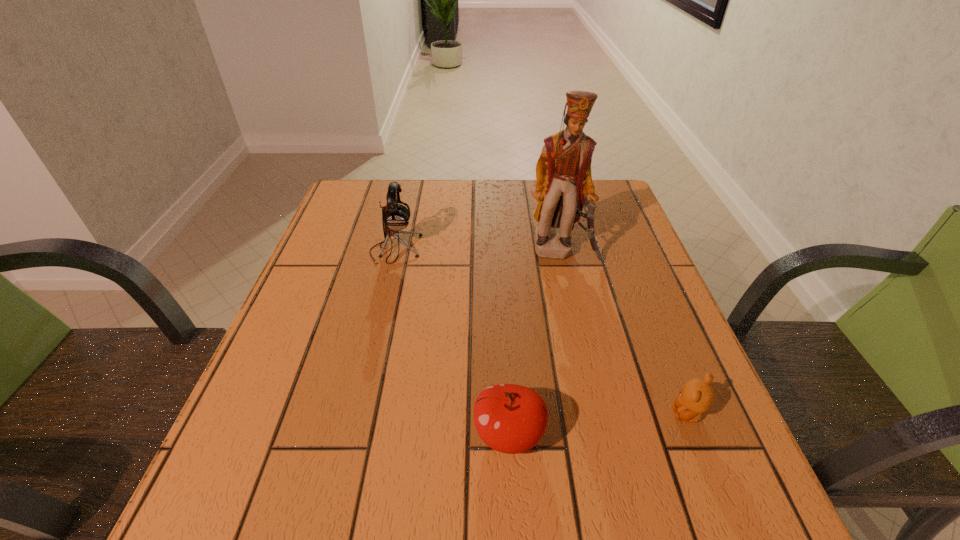
Where is `vacant region located on the left of the second object from left to right`? vacant region located on the left of the second object from left to right is located at coordinates (340, 434).

This screenshot has height=540, width=960. Identify the location of free spot located 0.080m on the face of the rightmost object. (625, 414).

Identify the location of vacant space situated on the face of the rightmost object. This screenshot has height=540, width=960. (572, 414).

Where is `free spot located 0.180m on the face of the rightmost object`? The image size is (960, 540). free spot located 0.180m on the face of the rightmost object is located at coordinates (566, 414).

Where is `object at the left edge`? This screenshot has width=960, height=540. object at the left edge is located at coordinates (395, 217).

Where is `nutcracker that is at the right edge`? The width and height of the screenshot is (960, 540). nutcracker that is at the right edge is located at coordinates (564, 184).

The width and height of the screenshot is (960, 540). What are the coordinates of `teddy bear located at the right edge` in the screenshot? It's located at (697, 396).

Locate an element on the screen. vacant region at the near edge of the desktop is located at coordinates (599, 509).

The image size is (960, 540). What are the coordinates of `free location at the left edge` in the screenshot? It's located at (362, 261).

The image size is (960, 540). Find the location of `vacant space at the right edge of the desktop`. vacant space at the right edge of the desktop is located at coordinates (609, 245).